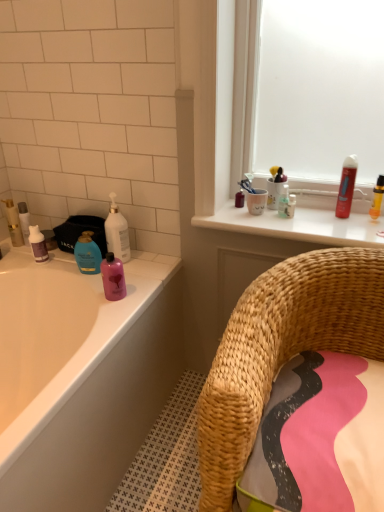
Locate an element on the screen. The width and height of the screenshot is (384, 512). vacant area that is in front of translucent plastic toothbrush holder at upper center, the 2th toiletry in the right-to-left sequence is located at coordinates (302, 227).